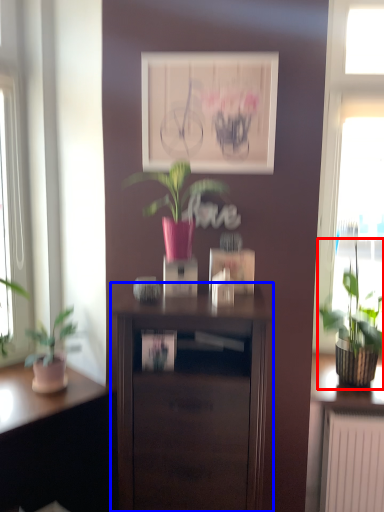
Question: Which of the following is the farthest to the observer, houseplant (highlighted by a red box) or nightstand (highlighted by a blue box)?

Choices:
 (A) houseplant
 (B) nightstand

Answer: (A)